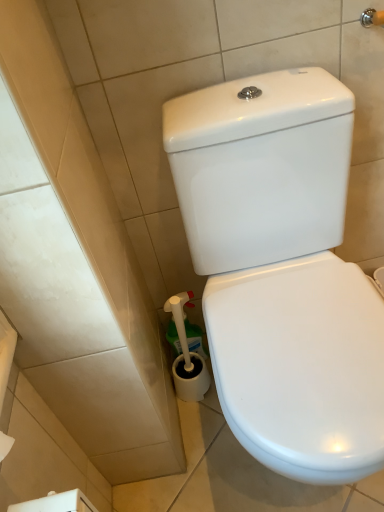
Question: Can you confirm if white glossy toilet at center is thinner than white plastic toilet brush at lower left?

Choices:
 (A) no
 (B) yes

Answer: (A)

Question: From a real-world perspective, is white glossy toilet at center on white plastic toilet brush at lower left?

Choices:
 (A) no
 (B) yes

Answer: (B)

Question: From the image's perspective, does white glossy toilet at center appear lower than white plastic toilet brush at lower left?

Choices:
 (A) no
 (B) yes

Answer: (A)

Question: Considering the relative sizes of white glossy toilet at center and white plastic toilet brush at lower left in the image provided, is white glossy toilet at center wider than white plastic toilet brush at lower left?

Choices:
 (A) yes
 (B) no

Answer: (A)

Question: Considering the relative positions of white glossy toilet at center and white plastic toilet brush at lower left in the image provided, is white glossy toilet at center to the left of white plastic toilet brush at lower left from the viewer's perspective?

Choices:
 (A) yes
 (B) no

Answer: (B)

Question: Does white glossy toilet at center have a greater height compared to white plastic toilet brush at lower left?

Choices:
 (A) yes
 (B) no

Answer: (A)

Question: Is white plastic toilet brush at lower left further to camera compared to white glossy toilet at center?

Choices:
 (A) no
 (B) yes

Answer: (B)

Question: Considering the relative sizes of white plastic toilet brush at lower left and white glossy toilet at center in the image provided, is white plastic toilet brush at lower left wider than white glossy toilet at center?

Choices:
 (A) no
 (B) yes

Answer: (A)

Question: From a real-world perspective, does white plastic toilet brush at lower left stand above white glossy toilet at center?

Choices:
 (A) no
 (B) yes

Answer: (A)

Question: Is white plastic toilet brush at lower left outside of white glossy toilet at center?

Choices:
 (A) yes
 (B) no

Answer: (A)

Question: Is white plastic toilet brush at lower left closer to camera compared to white glossy toilet at center?

Choices:
 (A) yes
 (B) no

Answer: (B)

Question: Is there a large distance between white plastic toilet brush at lower left and white glossy toilet at center?

Choices:
 (A) yes
 (B) no

Answer: (B)

Question: Looking at the image, does white glossy toilet at center seem bigger or smaller compared to white plastic toilet brush at lower left?

Choices:
 (A) big
 (B) small

Answer: (A)